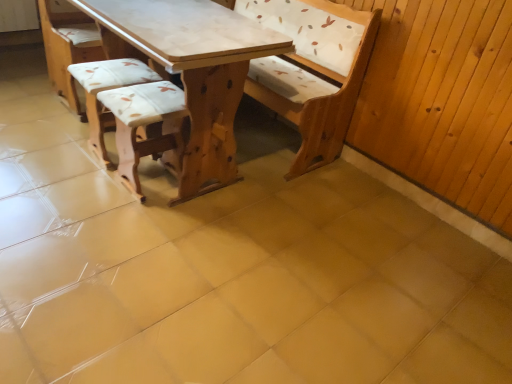
At what (x,y) coordinates should I click in order to perform the action: click on vacant space in front of light brown wood table at center. Please return your answer as a coordinate pair (x, y). The image size is (512, 384). Looking at the image, I should click on pyautogui.click(x=133, y=254).